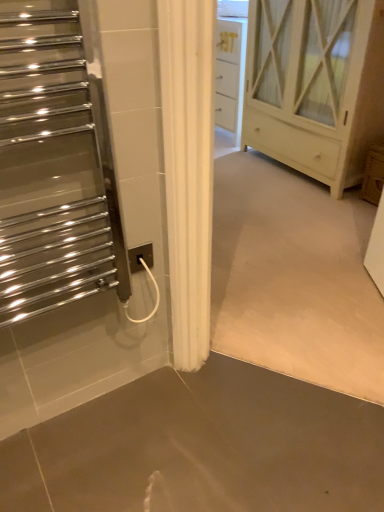
Question: Is the depth of white wood cabinet at center less than that of polished chrome towel warmer at left?

Choices:
 (A) yes
 (B) no

Answer: (B)

Question: Is white wood cabinet at center smaller than polished chrome towel warmer at left?

Choices:
 (A) no
 (B) yes

Answer: (A)

Question: Could you tell me if white wood cabinet at center is facing polished chrome towel warmer at left?

Choices:
 (A) yes
 (B) no

Answer: (A)

Question: Is white wood cabinet at center to the left of polished chrome towel warmer at left from the viewer's perspective?

Choices:
 (A) no
 (B) yes

Answer: (A)

Question: Are white wood cabinet at center and polished chrome towel warmer at left located far from each other?

Choices:
 (A) no
 (B) yes

Answer: (B)

Question: From the image's perspective, would you say white wood cabinet at center is positioned over polished chrome towel warmer at left?

Choices:
 (A) no
 (B) yes

Answer: (B)

Question: From a real-world perspective, is polished chrome towel warmer at left physically above smooth concrete floor at lower center?

Choices:
 (A) yes
 (B) no

Answer: (A)

Question: From a real-world perspective, is polished chrome towel warmer at left below smooth concrete floor at lower center?

Choices:
 (A) yes
 (B) no

Answer: (B)

Question: Can you confirm if polished chrome towel warmer at left is wider than smooth concrete floor at lower center?

Choices:
 (A) no
 (B) yes

Answer: (A)

Question: Does polished chrome towel warmer at left have a lesser height compared to smooth concrete floor at lower center?

Choices:
 (A) no
 (B) yes

Answer: (A)

Question: Is polished chrome towel warmer at left not near smooth concrete floor at lower center?

Choices:
 (A) yes
 (B) no

Answer: (B)

Question: Considering the relative sizes of polished chrome towel warmer at left and smooth concrete floor at lower center in the image provided, is polished chrome towel warmer at left thinner than smooth concrete floor at lower center?

Choices:
 (A) no
 (B) yes

Answer: (B)

Question: Is white wood cabinet at center facing away from white plastic electric outlet at center?

Choices:
 (A) no
 (B) yes

Answer: (A)